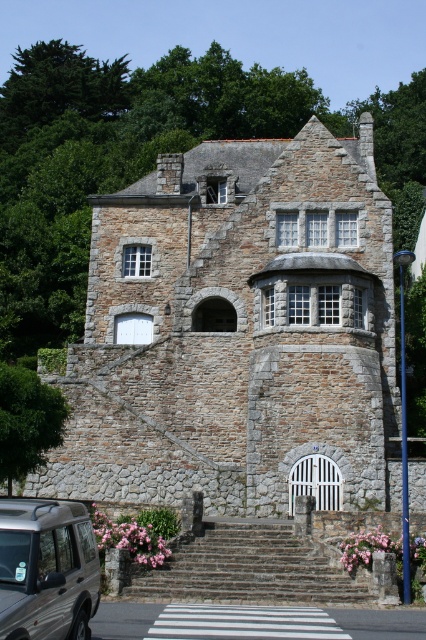
Is brown stone stairs at center bigger than metallic silver suv at lower left?

Yes, brown stone stairs at center is bigger than metallic silver suv at lower left.

Between brown stone stairs at center and metallic silver suv at lower left, which one appears on the left side from the viewer's perspective?

Positioned to the left is metallic silver suv at lower left.

Who is more forward, (176, 563) or (25, 616)?

Point (25, 616) is in front.

You are a GUI agent. You are given a task and a screenshot of the screen. Output one action in this format:
    pyautogui.click(x=<x>, y=<y>)
    Task: Click on the brown stone stairs at center
    The width and height of the screenshot is (426, 640).
    Given the screenshot: What is the action you would take?
    249,568